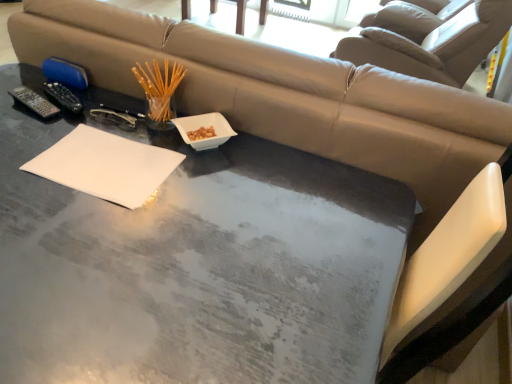
Identify the location of vacant space underneath white matte notepad at center (from a real-world perspective). This screenshot has width=512, height=384. (112, 166).